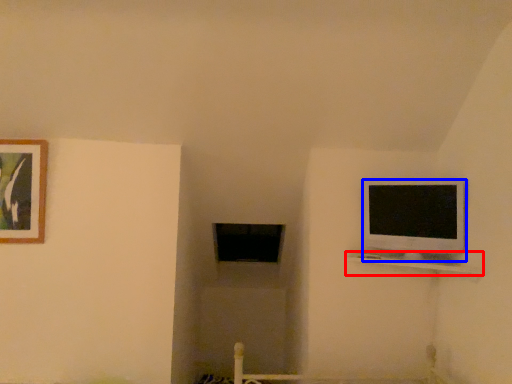
Question: Which object appears closest to the camera in this image, shelf (highlighted by a red box) or television (highlighted by a blue box)?

Choices:
 (A) shelf
 (B) television

Answer: (A)